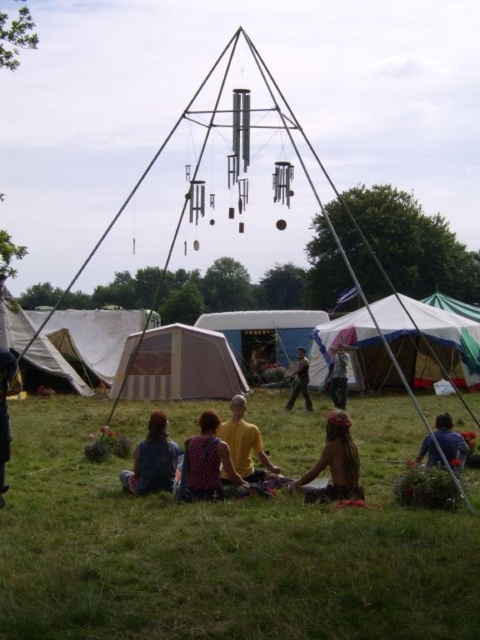
Who is lower down, brown leather bag at center or denim jacket at lower left?

denim jacket at lower left is lower down.

Locate an element on the screen. The width and height of the screenshot is (480, 640). brown leather bag at center is located at coordinates (335, 464).

Which is above, yellow matte shirt at center or blue fabric at lower right?

Positioned higher is yellow matte shirt at center.

Image resolution: width=480 pixels, height=640 pixels. Describe the element at coordinates (244, 444) in the screenshot. I see `yellow matte shirt at center` at that location.

Find the location of a particular element. This screenshot has width=480, height=640. yellow matte shirt at center is located at coordinates (244, 444).

From the picture: Which is more to the left, denim jacket at lower left or camouflage fabric person at center?

denim jacket at lower left

Which is below, denim jacket at lower left or camouflage fabric person at center?

denim jacket at lower left is below.

You are a GUI agent. You are given a task and a screenshot of the screen. Output one action in this format:
    pyautogui.click(x=<x>, y=<y>)
    Task: Click on the denim jacket at lower left
    
    Given the screenshot: What is the action you would take?
    pyautogui.click(x=153, y=460)